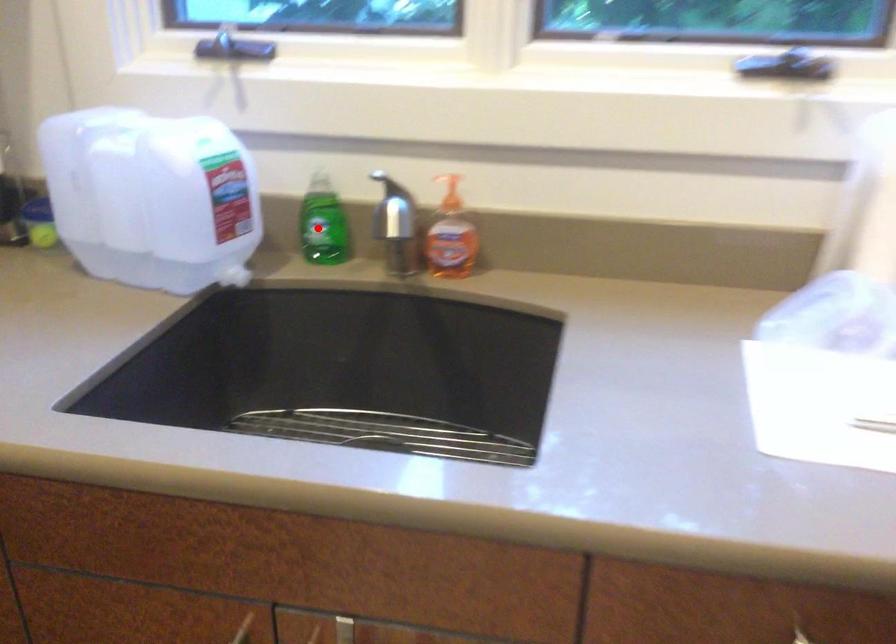
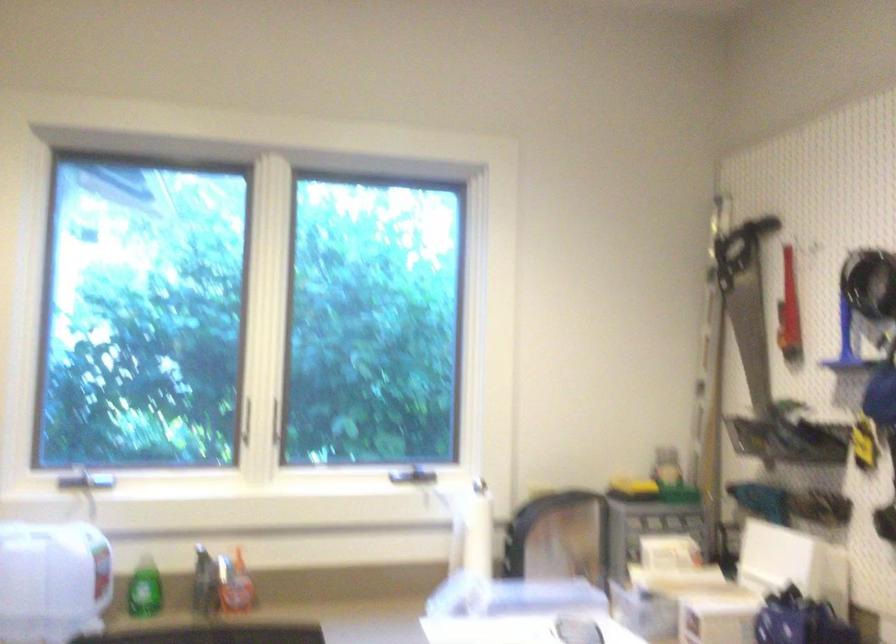
Question: I am providing you with two images of the same scene from different viewpoints. Given a red point in image1, look at the same physical point in image2. Is it:

Choices:
 (A) Closer to the viewpoint
 (B) Farther from the viewpoint

Answer: (B)